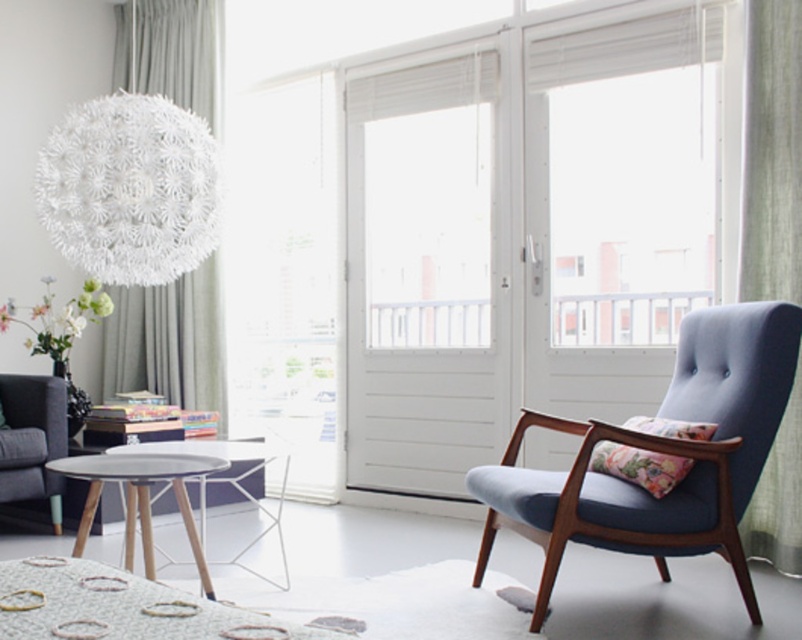
Between point (638, 442) and point (0, 417), which one is positioned behind?

Point (0, 417)

Describe the element at coordinates (659, 451) in the screenshot. The image size is (802, 640). I see `blue fabric armchair at right` at that location.

Identify the location of blue fabric armchair at right. The height and width of the screenshot is (640, 802). (659, 451).

Can you confirm if dark gray fabric couch at left is positioned to the right of matte gray table at center?

No, dark gray fabric couch at left is not to the right of matte gray table at center.

This screenshot has height=640, width=802. I want to click on dark gray fabric couch at left, so click(x=31, y=440).

Who is more forward, (51,484) or (278,515)?

Point (278,515) is in front.

This screenshot has width=802, height=640. I want to click on dark gray fabric couch at left, so click(31, 440).

Does green sheer curtain at right appear under matte gray table at center?

No.

Does point (792, 288) lie in front of point (177, 452)?

No, (792, 288) is behind (177, 452).

Locate an element on the screen. The width and height of the screenshot is (802, 640). green sheer curtain at right is located at coordinates (772, 154).